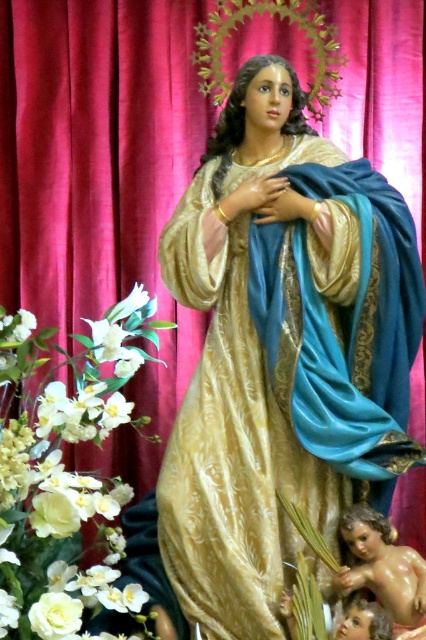
Question: Does gold satin robe at center lie behind smooth beige baby at lower right?

Choices:
 (A) yes
 (B) no

Answer: (A)

Question: Among these objects, which one is farthest from the camera?

Choices:
 (A) white silk flower at center
 (B) smooth beige baby at lower right
 (C) white silk flowers at left
 (D) gold satin robe at center

Answer: (A)

Question: Is gold satin robe at center smaller than smooth beige baby at lower right?

Choices:
 (A) no
 (B) yes

Answer: (A)

Question: Is gold satin robe at center positioned at the back of smooth beige baby at lower right?

Choices:
 (A) no
 (B) yes

Answer: (B)

Question: Which of the following is the farthest from the observer?

Choices:
 (A) (91, 326)
 (B) (388, 426)
 (C) (137, 307)
 (D) (359, 516)

Answer: (A)

Question: Among these objects, which one is farthest from the camera?

Choices:
 (A) white silk flowers at left
 (B) white silk flower at center
 (C) gold satin robe at center
 (D) smooth beige baby at lower right

Answer: (B)